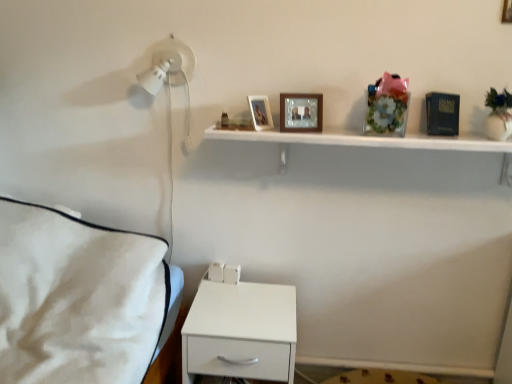
Identify the location of blank space situated above white matte nightstand at lower center (from a real-world perspective). (244, 306).